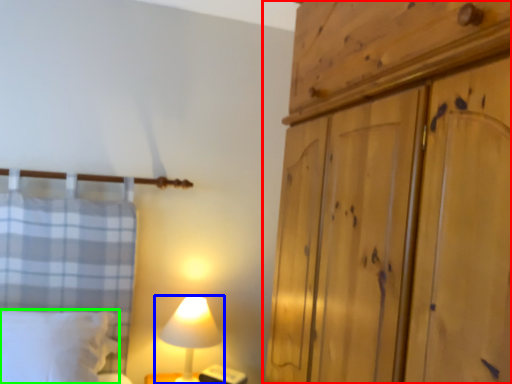
Question: Estimate the real-world distances between objects in this image. Which object is closer to cupboard (highlighted by a red box), lamp (highlighted by a blue box) or pillow (highlighted by a green box)?

Choices:
 (A) lamp
 (B) pillow

Answer: (A)